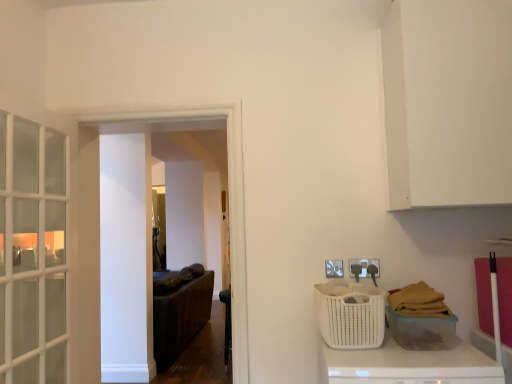
Where is `vacant region in front of white wicker basket at lower right, the second basket when ordered from left to right`? vacant region in front of white wicker basket at lower right, the second basket when ordered from left to right is located at coordinates (434, 362).